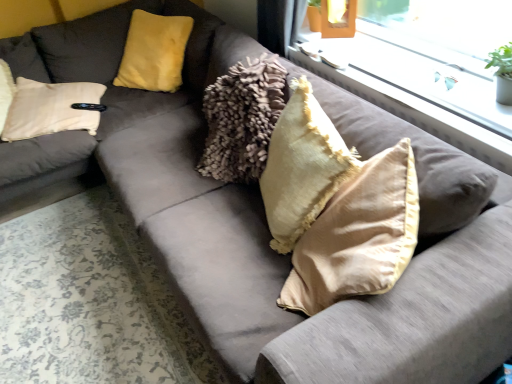
Question: From a real-world perspective, relative to satin beige pillow at center, the third pillow in the left-to-right sequence, is clear glass window at upper center vertically above or below?

Choices:
 (A) below
 (B) above

Answer: (B)

Question: In terms of width, does clear glass window at upper center look wider or thinner when compared to satin beige pillow at center, the 1th pillow in the front-to-back sequence?

Choices:
 (A) wide
 (B) thin

Answer: (B)

Question: Which object is positioned closest to the beige velvet pillow at center, the second pillow viewed from the back?

Choices:
 (A) clear glass window at upper center
 (B) velvet yellow pillow at upper left, which appears as the first pillow when viewed from the back
 (C) satin beige pillow at center, the 3th pillow positioned from the back

Answer: (C)

Question: Estimate the real-world distances between objects in this image. Which object is farther from the clear glass window at upper center?

Choices:
 (A) satin beige pillow at center, the 1th pillow in the front-to-back sequence
 (B) velvet yellow pillow at upper left, which appears as the first pillow when viewed from the back
 (C) beige velvet pillow at center, the 2th pillow viewed from the right

Answer: (B)